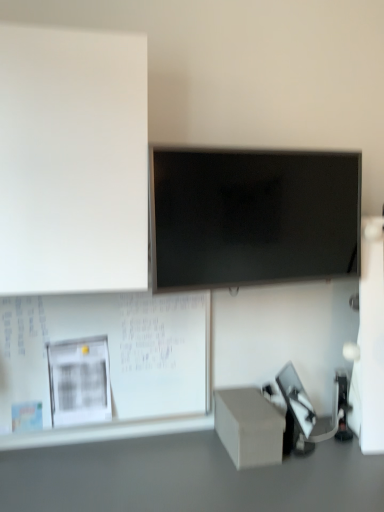
Question: Does matte black screen at center have a greater height compared to white matte bulletin board at lower left, arranged as the 1th bulletin board when ordered from the bottom?

Choices:
 (A) no
 (B) yes

Answer: (A)

Question: Is matte black screen at center far from white matte bulletin board at lower left, the 2th bulletin board when ordered from top to bottom?

Choices:
 (A) no
 (B) yes

Answer: (A)

Question: Is matte black screen at center oriented away from white matte bulletin board at lower left, the 2th bulletin board when ordered from top to bottom?

Choices:
 (A) no
 (B) yes

Answer: (A)

Question: From a real-world perspective, is matte black screen at center positioned over white matte bulletin board at lower left, the 2th bulletin board when ordered from top to bottom, based on gravity?

Choices:
 (A) no
 (B) yes

Answer: (B)

Question: Is matte black screen at center not inside white matte bulletin board at lower left, the 2th bulletin board when ordered from top to bottom?

Choices:
 (A) yes
 (B) no

Answer: (A)

Question: Is matte black screen at center situated inside white matte bulletin board at lower left, arranged as the 1th bulletin board when ordered from the bottom, or outside?

Choices:
 (A) inside
 (B) outside

Answer: (B)

Question: Based on their sizes in the image, would you say matte black screen at center is bigger or smaller than white matte bulletin board at lower left, the 2th bulletin board when ordered from top to bottom?

Choices:
 (A) small
 (B) big

Answer: (A)

Question: Considering the positions of point coord(170,278) and point coord(127,314), is point coord(170,278) closer or farther from the camera than point coord(127,314)?

Choices:
 (A) farther
 (B) closer

Answer: (B)

Question: Is matte black screen at center in front of or behind white matte bulletin board at lower left, arranged as the 1th bulletin board when ordered from the bottom, in the image?

Choices:
 (A) behind
 (B) front

Answer: (B)

Question: Visually, is white matte board at upper left, positioned as the first bulletin board in top-to-bottom order, positioned to the left or to the right of matte black screen at center?

Choices:
 (A) right
 (B) left

Answer: (B)

Question: Is point (100, 113) positioned closer to the camera than point (210, 224)?

Choices:
 (A) farther
 (B) closer

Answer: (B)

Question: In the image, is white matte board at upper left, positioned as the first bulletin board in top-to-bottom order, positioned in front of or behind matte black screen at center?

Choices:
 (A) behind
 (B) front

Answer: (B)

Question: From their relative heights in the image, would you say white matte board at upper left, positioned as the first bulletin board in top-to-bottom order, is taller or shorter than matte black screen at center?

Choices:
 (A) short
 (B) tall

Answer: (B)

Question: Considering the positions of matte gray cube at lower right and smooth gray table at lower center in the image, is matte gray cube at lower right taller or shorter than smooth gray table at lower center?

Choices:
 (A) tall
 (B) short

Answer: (B)

Question: From the image's perspective, is matte gray cube at lower right located above or below smooth gray table at lower center?

Choices:
 (A) below
 (B) above

Answer: (B)